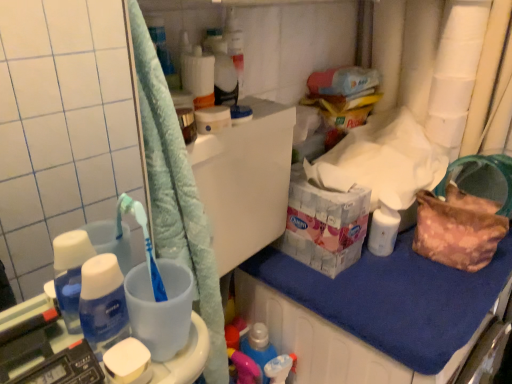
The height and width of the screenshot is (384, 512). I want to click on free space to the left of white glossy bottle at right, so click(x=324, y=271).